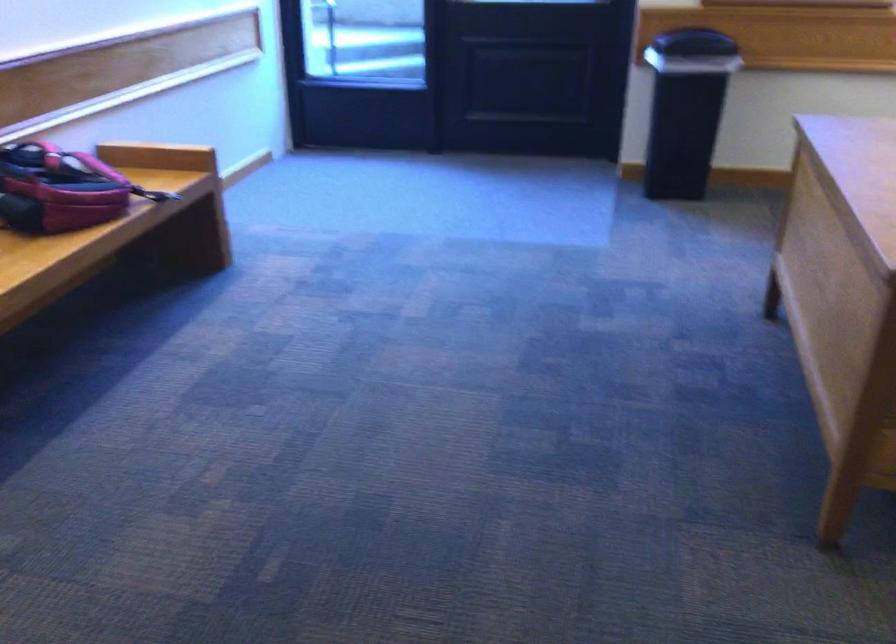
The width and height of the screenshot is (896, 644). Describe the element at coordinates (152, 194) in the screenshot. I see `the red bag strap` at that location.